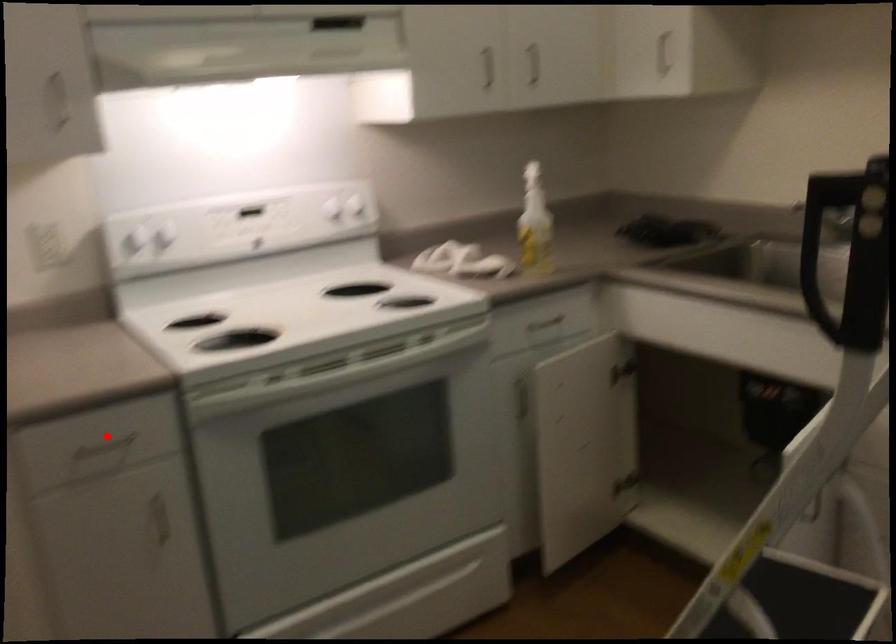
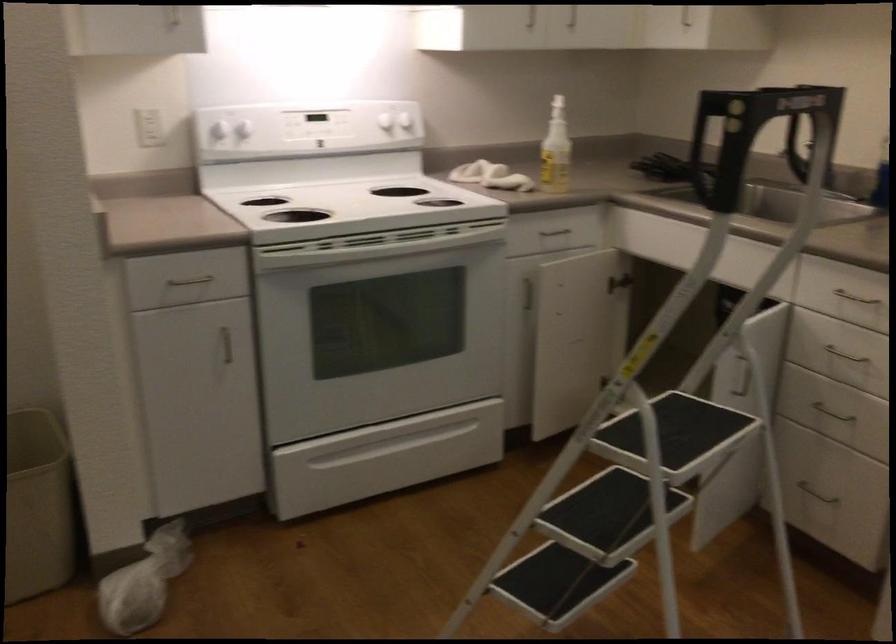
The point at the highlighted location is marked in the first image. Where is the corresponding point in the second image?

(191, 272)